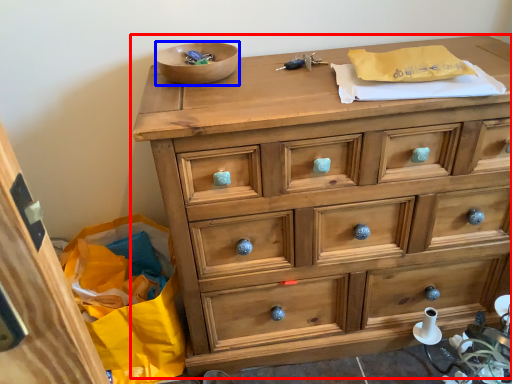
Question: Which point is closer to the camera, chest of drawers (highlighted by a red box) or bowl (highlighted by a blue box)?

Choices:
 (A) chest of drawers
 (B) bowl

Answer: (A)